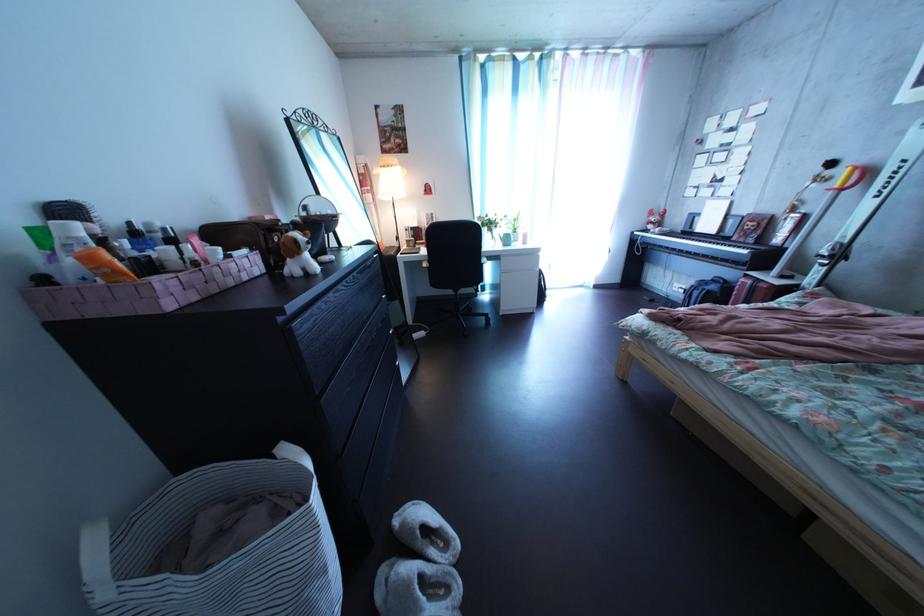
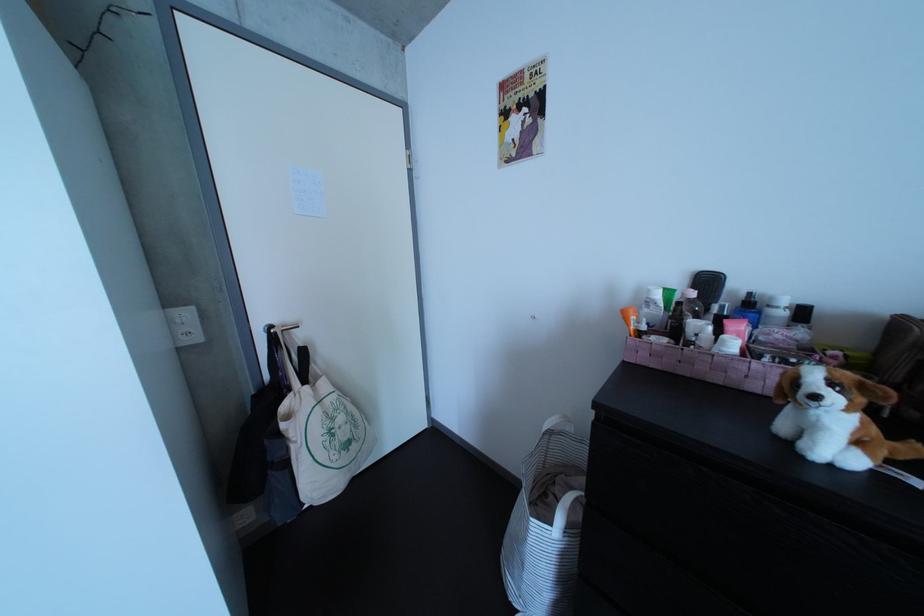
Locate, in the second image, the point that corresponds to point 310,249 in the first image.

(809, 389)